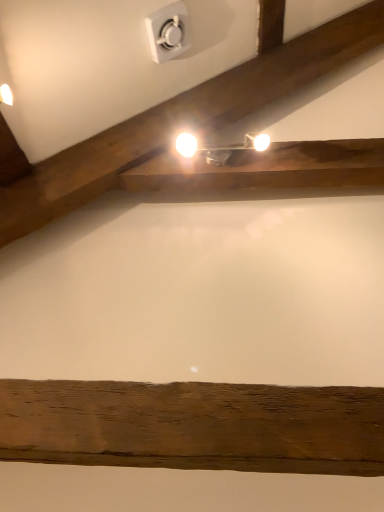
Question: Is white plastic electric outlet at upper center not inside matte silver fixture at upper center?

Choices:
 (A) yes
 (B) no

Answer: (A)

Question: Is the position of white plastic electric outlet at upper center more distant than that of matte silver fixture at upper center?

Choices:
 (A) yes
 (B) no

Answer: (B)

Question: Is white plastic electric outlet at upper center taller than matte silver fixture at upper center?

Choices:
 (A) no
 (B) yes

Answer: (B)

Question: Is white plastic electric outlet at upper center beside matte silver fixture at upper center?

Choices:
 (A) yes
 (B) no

Answer: (B)

Question: Does white plastic electric outlet at upper center have a lesser width compared to matte silver fixture at upper center?

Choices:
 (A) yes
 (B) no

Answer: (A)

Question: Does white plastic electric outlet at upper center appear on the right side of matte silver fixture at upper center?

Choices:
 (A) no
 (B) yes

Answer: (A)

Question: Considering the relative sizes of matte silver fixture at upper center and white plastic electric outlet at upper center in the image provided, is matte silver fixture at upper center thinner than white plastic electric outlet at upper center?

Choices:
 (A) no
 (B) yes

Answer: (A)

Question: From a real-world perspective, is matte silver fixture at upper center on top of white plastic electric outlet at upper center?

Choices:
 (A) no
 (B) yes

Answer: (A)

Question: Does matte silver fixture at upper center appear on the left side of white plastic electric outlet at upper center?

Choices:
 (A) no
 (B) yes

Answer: (A)

Question: From the image's perspective, does matte silver fixture at upper center appear higher than white plastic electric outlet at upper center?

Choices:
 (A) yes
 (B) no

Answer: (B)

Question: Is matte silver fixture at upper center shorter than white plastic electric outlet at upper center?

Choices:
 (A) yes
 (B) no

Answer: (A)

Question: Is matte silver fixture at upper center outside white plastic electric outlet at upper center?

Choices:
 (A) yes
 (B) no

Answer: (A)

Question: Considering their positions, is matte silver fixture at upper center located in front of or behind white plastic electric outlet at upper center?

Choices:
 (A) front
 (B) behind

Answer: (B)